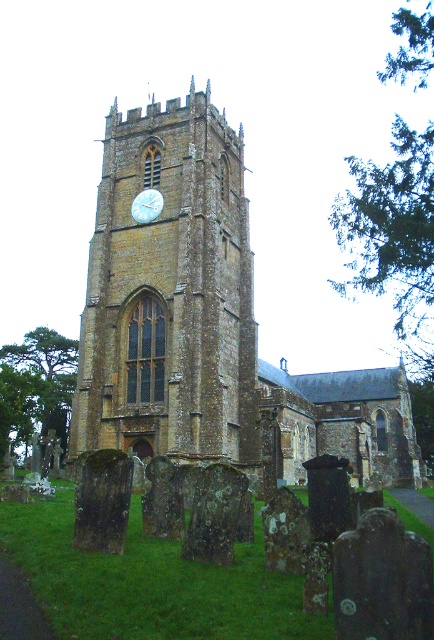
You are an architect visiting the historic stone church and want to compare the sizes of the brown stone clock tower at center and the white glossy clock at upper center. Which object is bigger?

The brown stone clock tower at center is larger in size than the white glossy clock at upper center.

You are standing in front of the historic stone church and notice the brown stone clock tower at center and the white glossy clock at upper center. Which object is closer to you?

The brown stone clock tower at center is closer to you because it is in front of the white glossy clock at upper center.

You are standing in a park 60 meters away from the brown stone clock tower at center. You want to take a photo of it using a standard smartphone camera. Can you fit the entire clock tower into your camera frame without moving closer or farther away?

The brown stone clock tower at center is 58.58 meters from viewer, so yes, you can fit the entire clock tower into your camera frame since you are standing 60 meters away, which is slightly farther than the required distance.